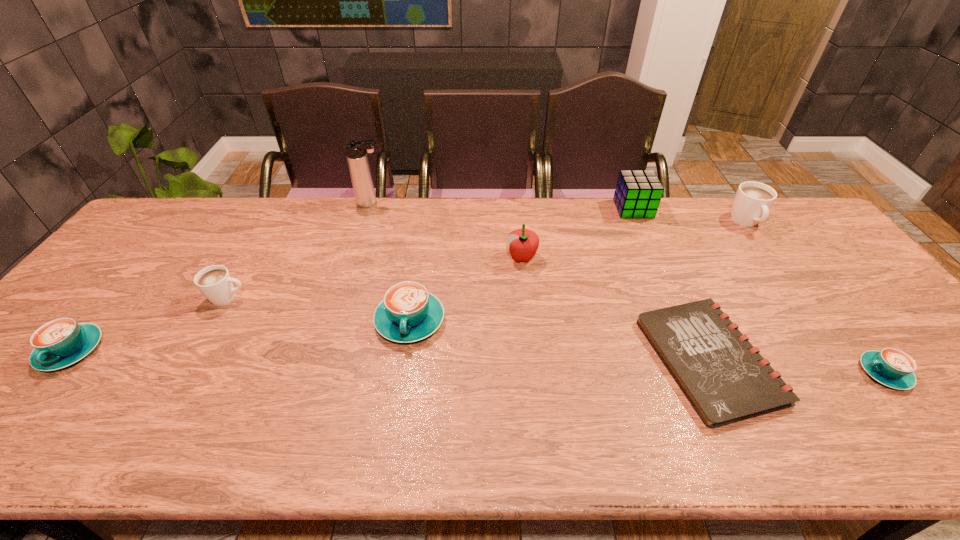
I want to click on object at the near edge, so click(724, 377).

Find the location of `object present at the left edge`. object present at the left edge is located at coordinates (62, 342).

Where is `object located in the far right corner section of the desktop`? object located in the far right corner section of the desktop is located at coordinates (751, 205).

At what (x,y) coordinates should I click in order to perform the action: click on free space at the far edge of the desktop. Please return your answer as a coordinate pair (x, y). The image size is (960, 540). Looking at the image, I should click on (417, 202).

Locate an element on the screen. Image resolution: width=960 pixels, height=540 pixels. vacant space at the near edge of the desktop is located at coordinates (267, 417).

I want to click on vacant space at the left edge of the desktop, so click(x=136, y=251).

Where is `free space at the right edge of the desktop`? The height and width of the screenshot is (540, 960). free space at the right edge of the desktop is located at coordinates (810, 254).

In the image, there is a desktop. Identify the location of vacant area at the far left corner. (181, 212).

Identify the location of free space at the near left corner of the desktop. (34, 436).

Identify the location of vacant space in between the sixth object from right to left and the cube. (521, 265).